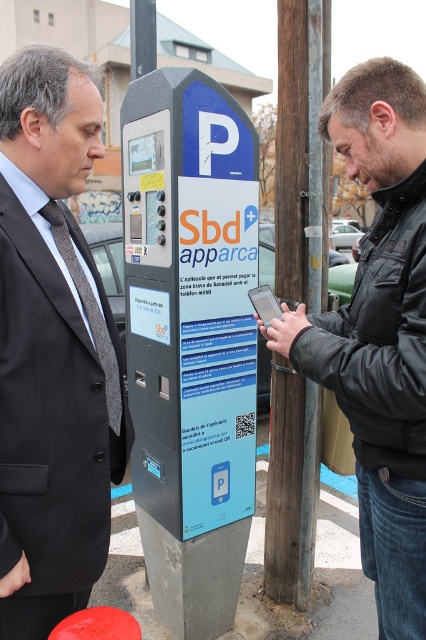
Is dark gray suit at left bigger than rubber red stool at lower left?

Yes, dark gray suit at left is bigger than rubber red stool at lower left.

Between dark gray suit at left and rubber red stool at lower left, which one is positioned higher?

dark gray suit at left is above.

This screenshot has width=426, height=640. In order to click on dark gray suit at left in this screenshot , I will do `click(52, 349)`.

Does dark gray suit at left have a lesser width compared to matte black phone at center?

Incorrect, dark gray suit at left's width is not less than matte black phone at center's.

This screenshot has width=426, height=640. I want to click on dark gray suit at left, so click(52, 349).

In order to click on dark gray suit at left in this screenshot , I will do `click(52, 349)`.

Does black leather jacket at center appear on the left side of rubber red stool at lower left?

No, black leather jacket at center is not to the left of rubber red stool at lower left.

Which is behind, point (397, 272) or point (86, 618)?

Positioned behind is point (397, 272).

What do you see at coordinates (379, 332) in the screenshot? I see `black leather jacket at center` at bounding box center [379, 332].

This screenshot has height=640, width=426. In order to click on black leather jacket at center in this screenshot , I will do `click(379, 332)`.